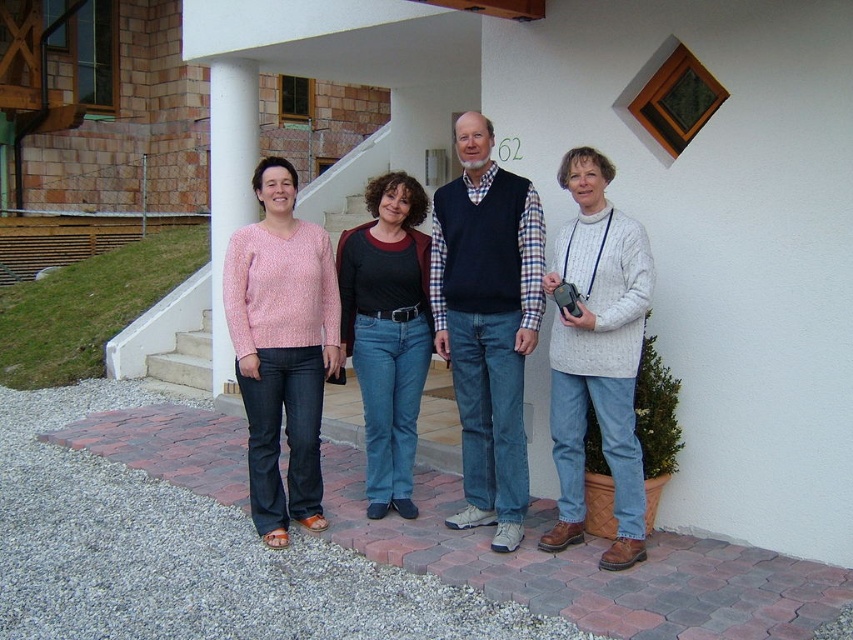
In the scene shown: Is white knitted sweater at center taller than pink sweater at center?

Incorrect, white knitted sweater at center's height is not larger of pink sweater at center's.

Which is behind, point (560, 456) or point (245, 157)?

Point (245, 157)

Is point (631, 522) positioned in front of point (221, 152)?

Yes, it is in front of point (221, 152).

You are a GUI agent. You are given a task and a screenshot of the screen. Output one action in this format:
    pyautogui.click(x=<x>, y=<y>)
    Task: Click on the white knitted sweater at center
    The image size is (853, 640).
    Given the screenshot: What is the action you would take?
    pyautogui.click(x=596, y=355)

Is matte pink sweater at center smaller than denim jeans at center?

No.

Is matte pink sweater at center positioned at the back of denim jeans at center?

No, it is in front of denim jeans at center.

Does point (479, 253) lie behind point (386, 204)?

No.

At what (x,y) coordinates should I click in order to perform the action: click on matte pink sweater at center. Please return your answer as a coordinate pair (x, y). Looking at the image, I should click on (532, 340).

Can you confirm if matte pink sweater at center is smaller than blue jeans at center?

No, matte pink sweater at center is not smaller than blue jeans at center.

Is point (368, 440) farther from camera compared to point (447, 348)?

Yes, point (368, 440) is farther from viewer.

The height and width of the screenshot is (640, 853). Describe the element at coordinates (532, 340) in the screenshot. I see `matte pink sweater at center` at that location.

Locate an element on the screen. The image size is (853, 640). matte pink sweater at center is located at coordinates (532, 340).